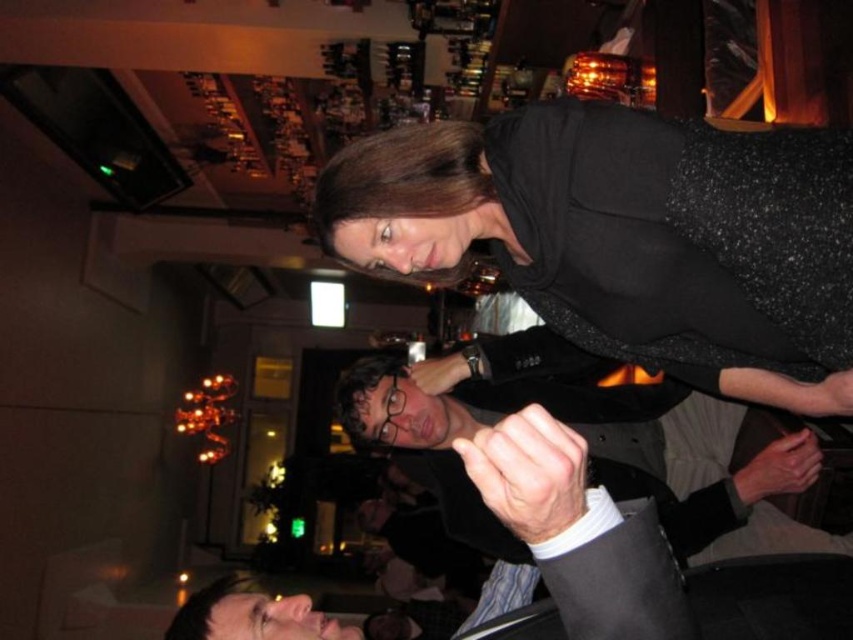
You are a photographer trying to capture a candid shot of both the black sequined dress at upper right and the matte black suit at center. Since you can only focus on one subject at a time, which one should you choose to ensure the other remains in the background?

You should focus on the black sequined dress at upper right because it is in front of the matte black suit at center, so if you focus on the dress, the suit will naturally be in the background.

You are standing at the bar and want to move from point A to point B. Point A is located at coordinates point (569, 221) and point B is at point (775, 460). Which point is closer to you?

Point (569, 221) is in front of point (775, 460), so point (569, 221) is closer to you.